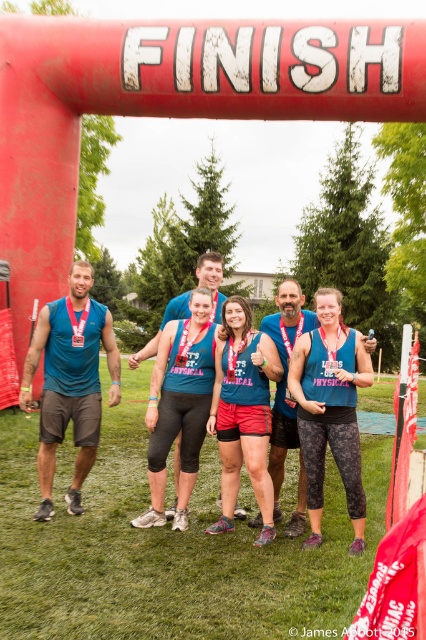
Question: Does teal fabric tank top at center have a larger size compared to matte teal tank top at center?

Choices:
 (A) yes
 (B) no

Answer: (B)

Question: Which point appears closest to the camera in this image?

Choices:
 (A) (192, 451)
 (B) (247, 316)

Answer: (B)

Question: Is matte blue tank top at left above matte teal tank top at center?

Choices:
 (A) no
 (B) yes

Answer: (B)

Question: Which object appears farthest from the camera in this image?

Choices:
 (A) teal fabric tank top at center
 (B) matte blue tank top at left
 (C) matte teal tank top at center
 (D) blue fabric tank top at center

Answer: (C)

Question: Is matte blue tank top at left wider than blue fabric tank top at center?

Choices:
 (A) no
 (B) yes

Answer: (B)

Question: Which object appears farthest from the camera in this image?

Choices:
 (A) matte teal tank top at center
 (B) blue fabric tank top at center

Answer: (A)